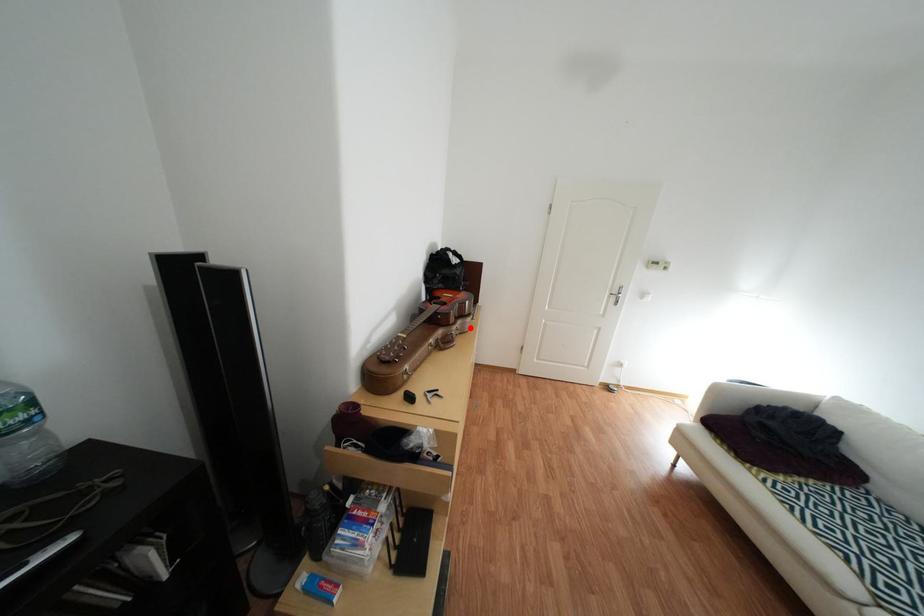
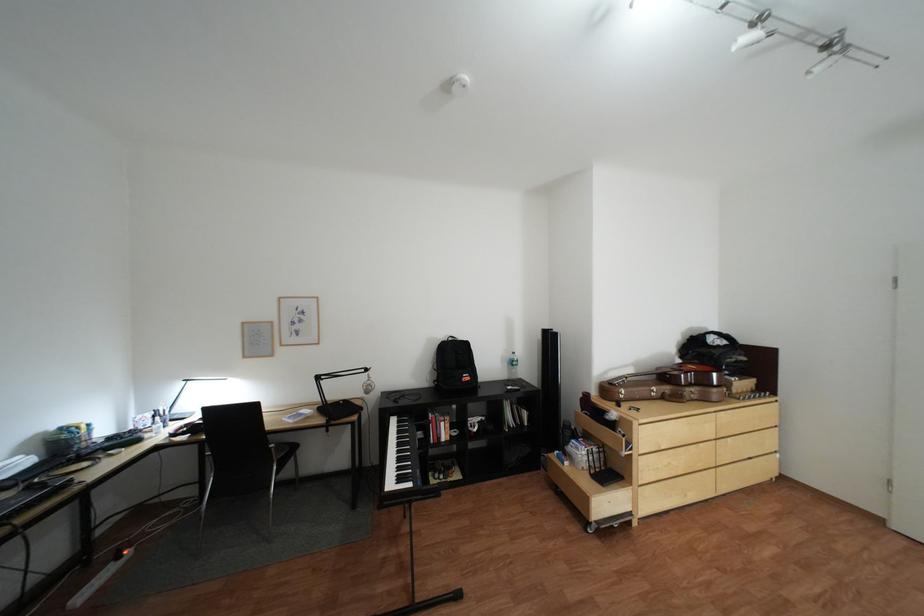
The point at the highlighted location is marked in the first image. Where is the corresponding point in the second image?

(703, 391)